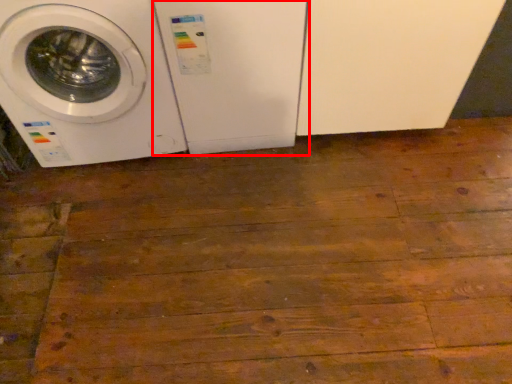
Question: From the image's perspective, where is washing machine (annotated by the red box) located in relation to washing machine in the image?

Choices:
 (A) below
 (B) above

Answer: (B)